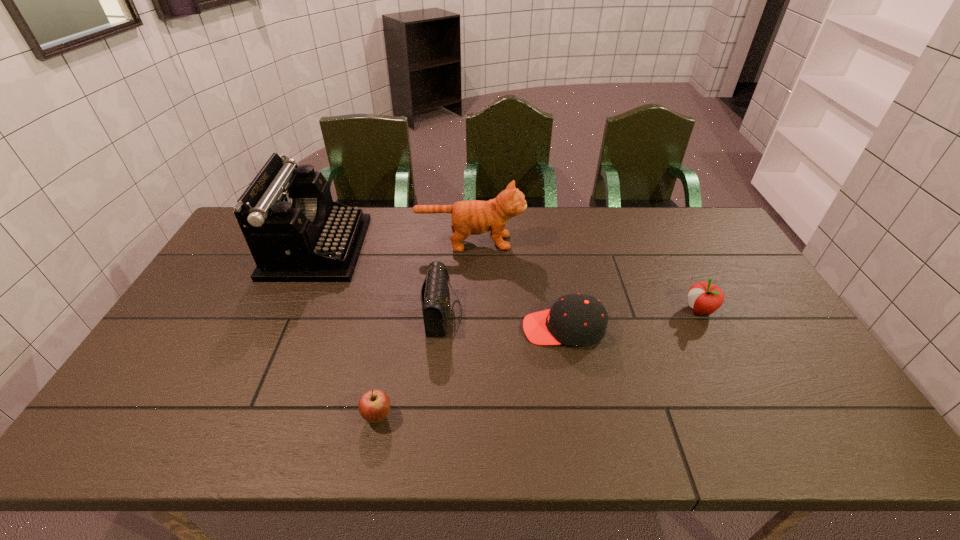
Locate an element on the screen. The image size is (960, 540). object located at the left edge is located at coordinates (295, 232).

The image size is (960, 540). In order to click on object situated at the far left corner in this screenshot , I will do `click(295, 232)`.

This screenshot has height=540, width=960. What are the coordinates of `vacant space at the far edge` in the screenshot? It's located at (526, 231).

Locate an element on the screen. vacant space at the near edge is located at coordinates (348, 417).

You are a GUI agent. You are given a task and a screenshot of the screen. Output one action in this format:
    pyautogui.click(x=<x>, y=<y>)
    Task: Click on the free space at the right edge of the desktop
    The width and height of the screenshot is (960, 540).
    Given the screenshot: What is the action you would take?
    pyautogui.click(x=790, y=364)

This screenshot has width=960, height=540. Find the location of `free space at the near left corner of the desktop`. free space at the near left corner of the desktop is located at coordinates (167, 435).

Locate an element on the screen. The image size is (960, 540). vacant space at the far right corner of the desktop is located at coordinates [x=684, y=220].

The image size is (960, 540). What are the coordinates of `free space between the leftmost object and the nearest object` in the screenshot? It's located at (348, 332).

Locate an element on the screen. This screenshot has width=960, height=540. free space between the cap and the clutch bag is located at coordinates (503, 321).

I want to click on free space between the shortest object and the cap, so click(470, 373).